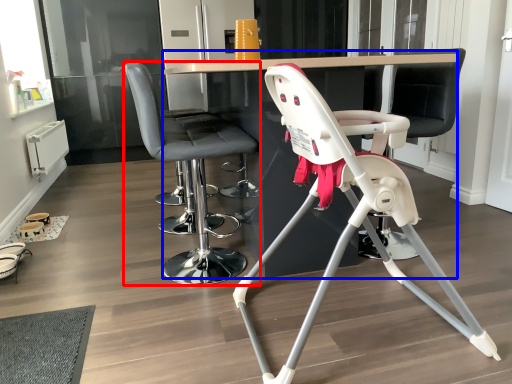
Question: Which object is further to the camera taking this photo, chair (highlighted by a red box) or table (highlighted by a blue box)?

Choices:
 (A) chair
 (B) table

Answer: (A)